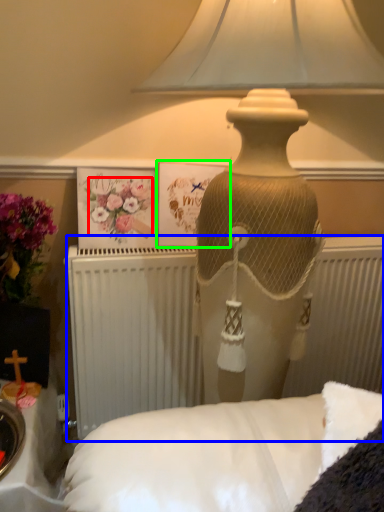
Question: Which is farther away from flower (highlighted by a red box)? radiator (highlighted by a blue box) or postcard (highlighted by a green box)?

Choices:
 (A) radiator
 (B) postcard

Answer: (A)